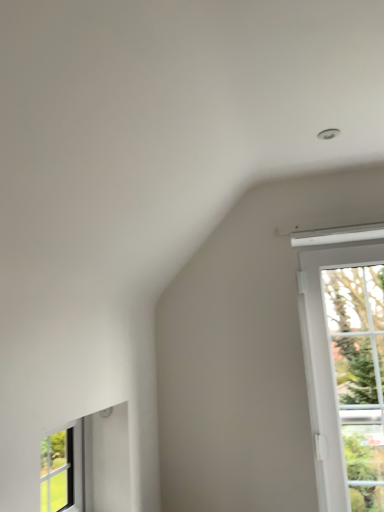
Based on the photo, what is the approximate width of white glass window at upper right?

7.49 inches.

The width and height of the screenshot is (384, 512). What do you see at coordinates (345, 370) in the screenshot?
I see `white glass window at upper right` at bounding box center [345, 370].

The height and width of the screenshot is (512, 384). I want to click on white glass window at upper right, so [x=345, y=370].

In order to click on white glass window at upper right in this screenshot , I will do `click(345, 370)`.